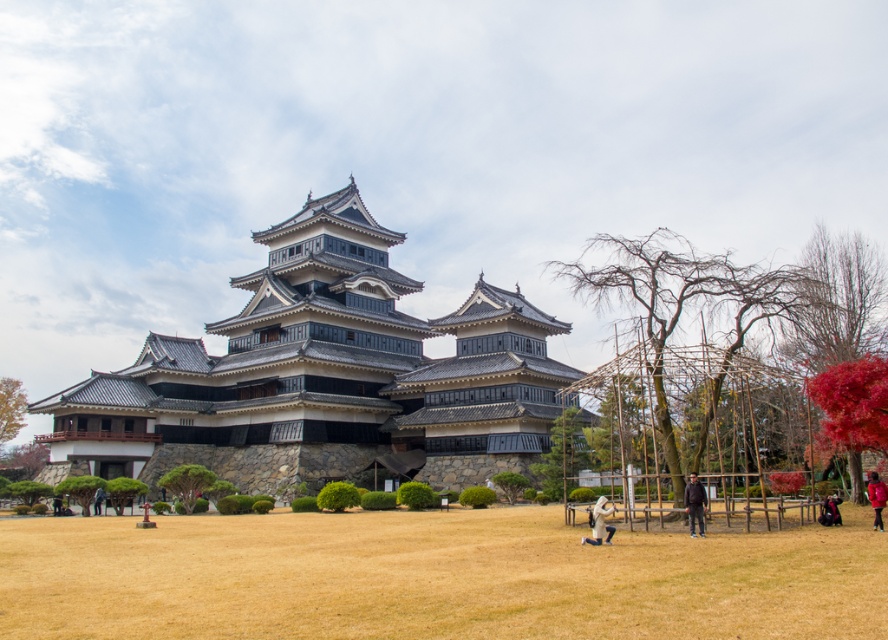
Who is shorter, green leafy tree at center or white fabric backpack at lower center?

white fabric backpack at lower center

Does green leafy tree at center have a greater height compared to white fabric backpack at lower center?

Correct, green leafy tree at center is much taller as white fabric backpack at lower center.

Which is in front, point (571, 483) or point (609, 513)?

Point (609, 513) is in front.

I want to click on green leafy tree at center, so click(561, 452).

Between vivid red leaves at right and green leafy shrub at lower left, which one appears on the left side from the viewer's perspective?

green leafy shrub at lower left is more to the left.

Is point (871, 387) farther from camera compared to point (6, 458)?

No, it is not.

Locate an element on the screen. This screenshot has height=640, width=888. vivid red leaves at right is located at coordinates (853, 403).

Can you confirm if brown grass at center is taller than vivid red leaves at right?

In fact, brown grass at center may be shorter than vivid red leaves at right.

Is point (632, 625) less distant than point (826, 438)?

Yes.

Is point (408, 580) closer to viewer compared to point (841, 412)?

Yes, it is in front of point (841, 412).

Locate an element on the screen. The width and height of the screenshot is (888, 640). brown grass at center is located at coordinates (433, 577).